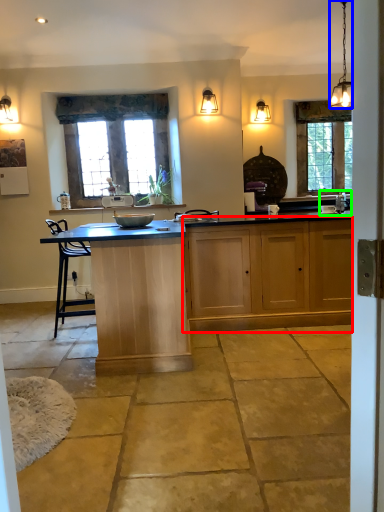
Question: Which is nearer to the cabinetry (highlighted by a red box)? light fixture (highlighted by a blue box) or sink (highlighted by a green box).

Choices:
 (A) light fixture
 (B) sink

Answer: (B)